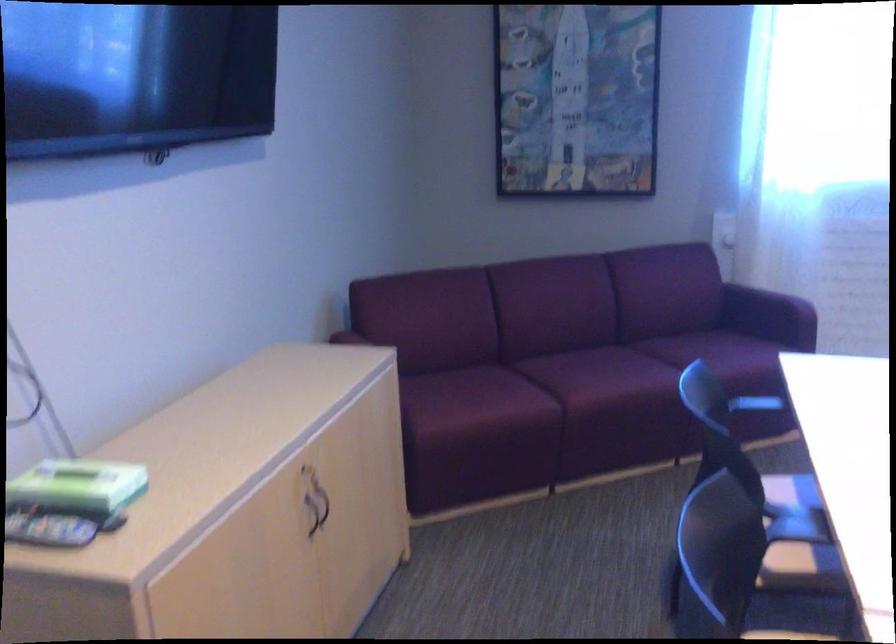
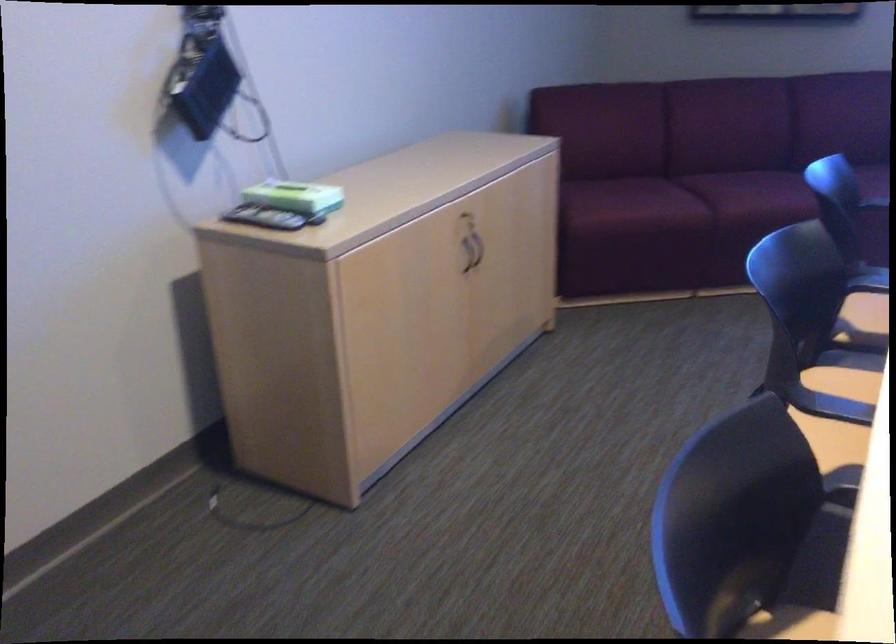
Find the pixel in the second image that matches (254,424) in the first image.

(428, 175)